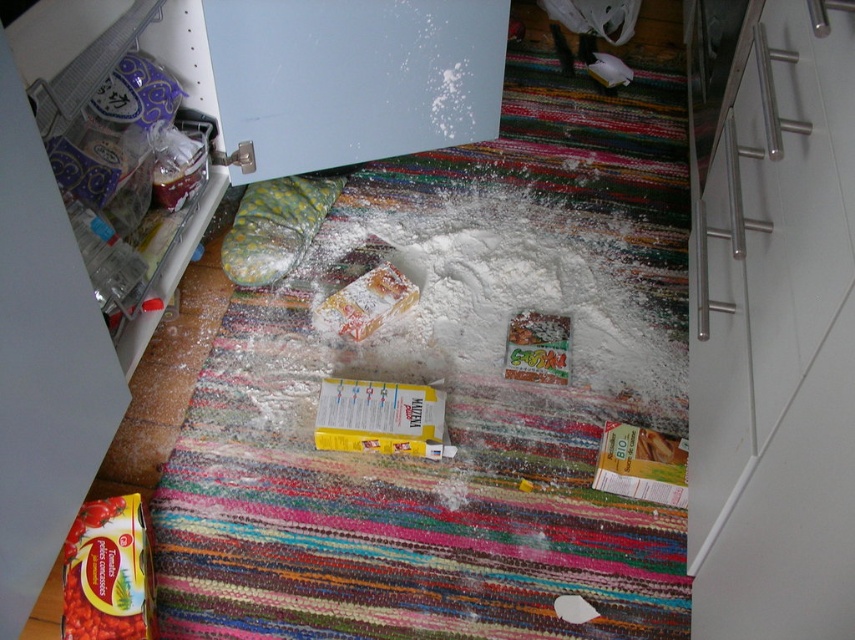
Is the position of white matte refrigerator at upper center less distant than that of matte yellow tomato paste at lower left?

Yes, white matte refrigerator at upper center is closer to the viewer.

From the picture: Is white matte refrigerator at upper center bigger than matte yellow tomato paste at lower left?

Yes, white matte refrigerator at upper center is bigger than matte yellow tomato paste at lower left.

This screenshot has height=640, width=855. What do you see at coordinates (335, 76) in the screenshot?
I see `white matte refrigerator at upper center` at bounding box center [335, 76].

The width and height of the screenshot is (855, 640). I want to click on white matte refrigerator at upper center, so (x=335, y=76).